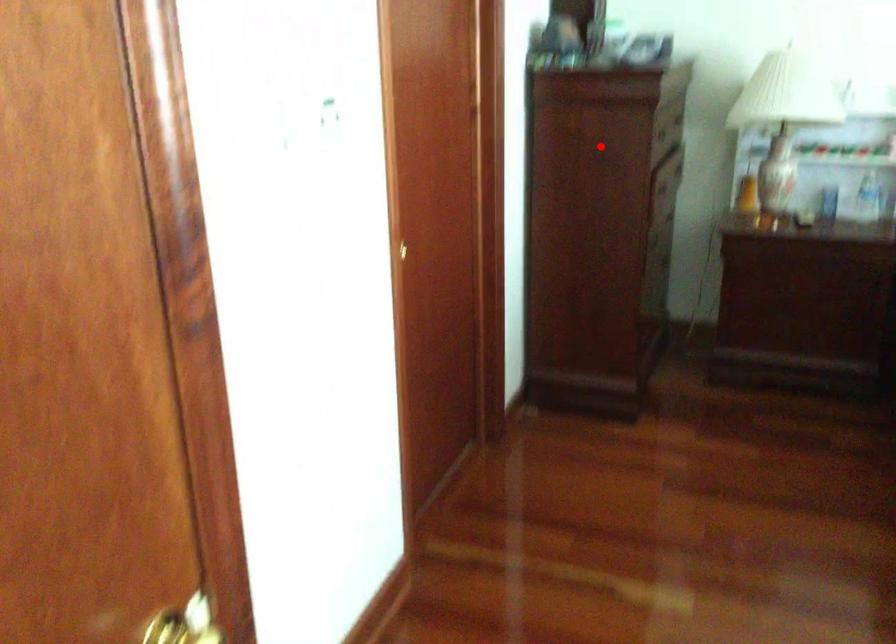
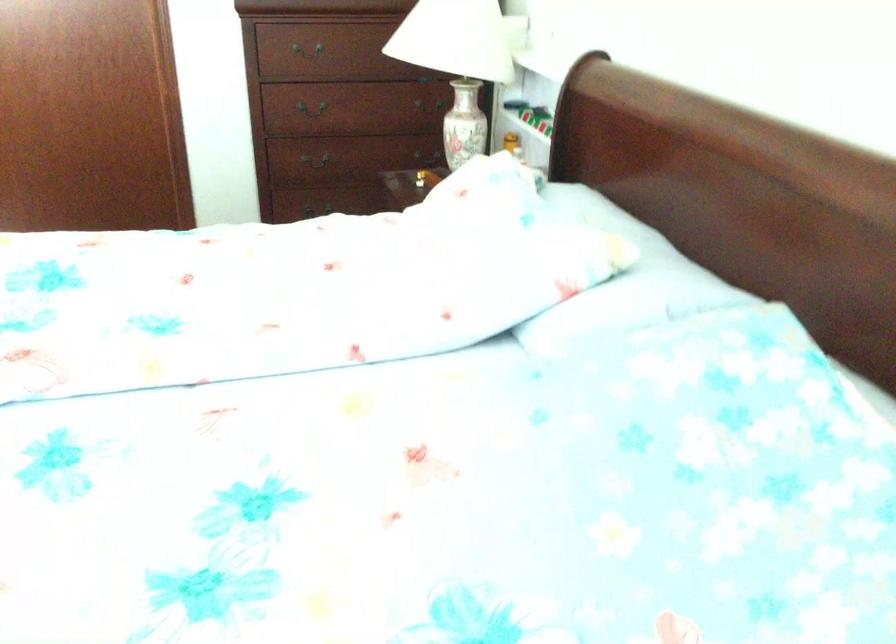
Locate, in the second image, the point that corresponds to the highlighted location in the first image.

(309, 52)